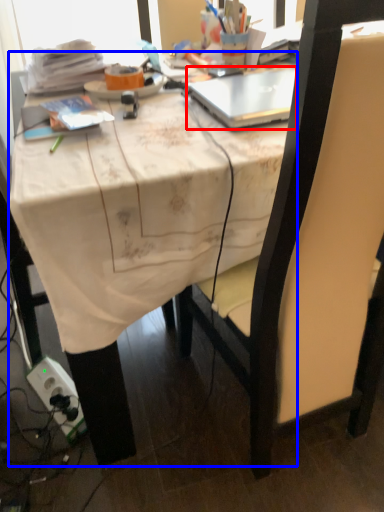
Question: Which object appears farthest to the camera in this image, laptop (highlighted by a red box) or desk (highlighted by a blue box)?

Choices:
 (A) laptop
 (B) desk

Answer: (A)